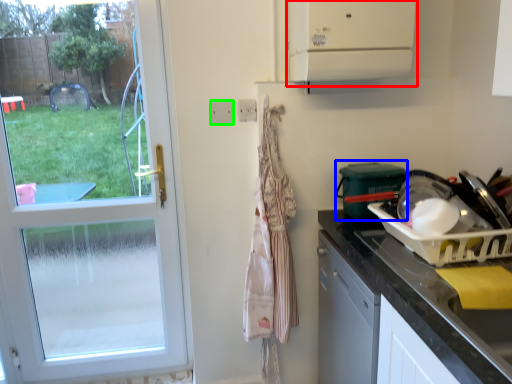
Question: Which object is the closest to the vent (highlighted by a red box)? Choose among these: appliance (highlighted by a blue box) or electric outlet (highlighted by a green box).

Choices:
 (A) appliance
 (B) electric outlet

Answer: (A)